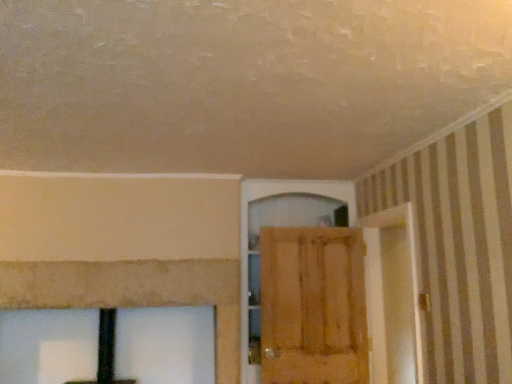
Question: From a real-world perspective, relative to wooden door at center, is wooden screen door at right vertically above or below?

Choices:
 (A) above
 (B) below

Answer: (A)

Question: Considering the positions of wooden screen door at right and wooden door at center in the image, is wooden screen door at right bigger or smaller than wooden door at center?

Choices:
 (A) big
 (B) small

Answer: (A)

Question: From the image's perspective, is wooden screen door at right located above or below wooden door at center?

Choices:
 (A) below
 (B) above

Answer: (B)

Question: From a real-world perspective, is wooden door at center above or below wooden screen door at right?

Choices:
 (A) above
 (B) below

Answer: (B)

Question: In terms of height, does wooden door at center look taller or shorter compared to wooden screen door at right?

Choices:
 (A) tall
 (B) short

Answer: (B)

Question: Considering the positions of wooden door at center and wooden screen door at right in the image, is wooden door at center bigger or smaller than wooden screen door at right?

Choices:
 (A) big
 (B) small

Answer: (B)

Question: Relative to wooden screen door at right, is wooden door at center in front or behind?

Choices:
 (A) behind
 (B) front

Answer: (A)